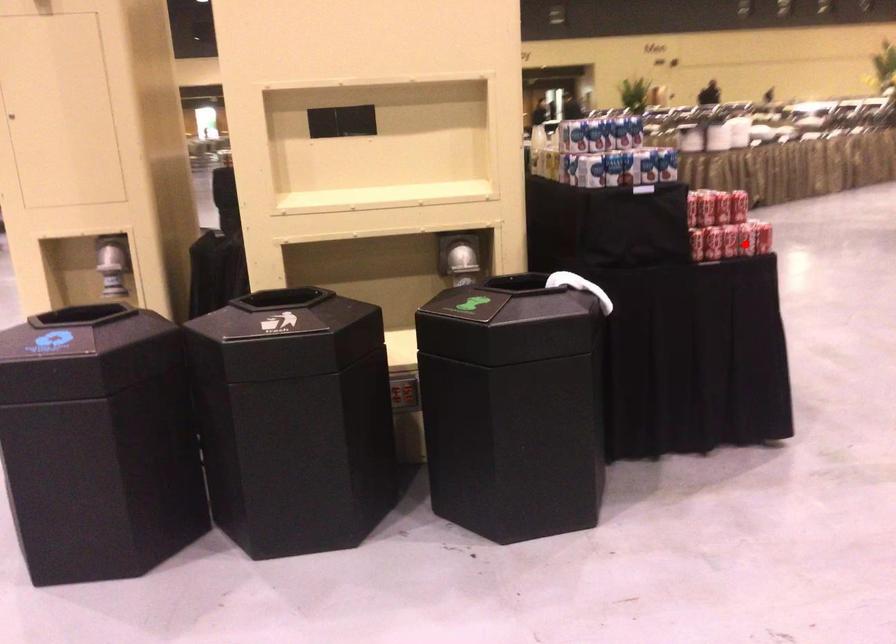
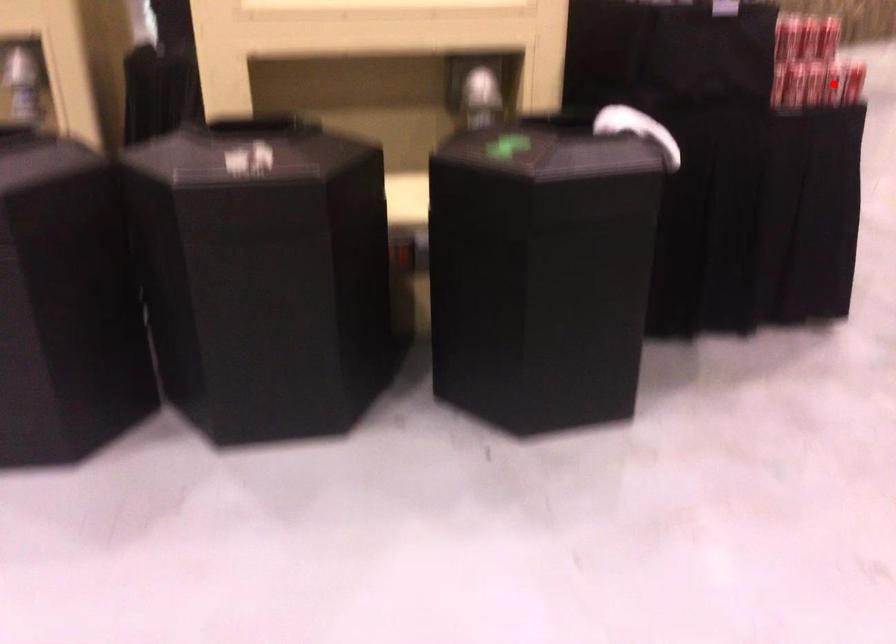
I am providing you with two images of the same scene from different viewpoints. A red point is marked on the first image and another point is marked on the second image. Is the marked point in image1 the same physical position as the marked point in image2?

Yes